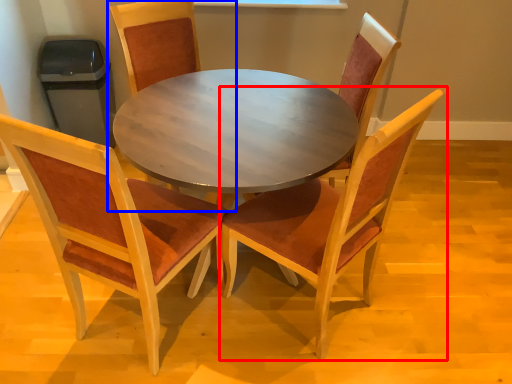
Question: Which object appears farthest to the camera in this image, chair (highlighted by a red box) or chair (highlighted by a blue box)?

Choices:
 (A) chair
 (B) chair

Answer: (B)